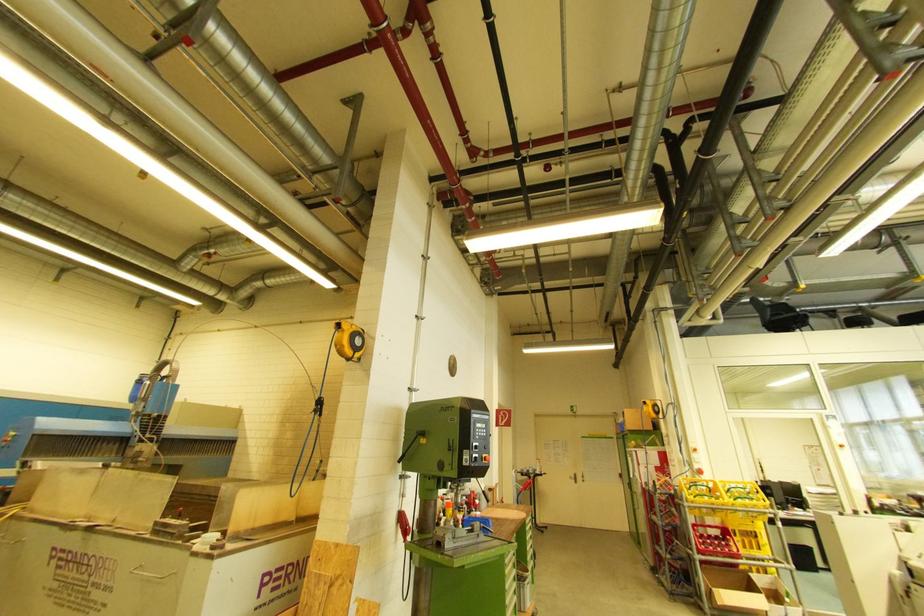
At what (x,y) coordinates should I click in order to perform the action: click on cardboard box. Please return your answer as a coordinate pair (x, y). Image resolution: width=924 pixels, height=616 pixels. Looking at the image, I should click on (734, 591).